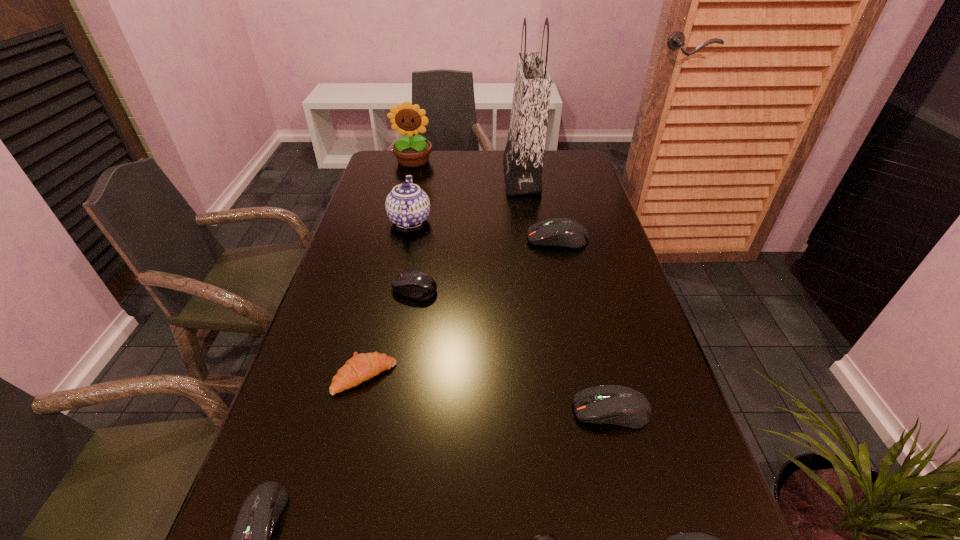
Where is `object at the far left corner`? The height and width of the screenshot is (540, 960). object at the far left corner is located at coordinates (411, 152).

Image resolution: width=960 pixels, height=540 pixels. In the image, there is a desktop. Identify the location of vacant area at the far edge. pos(435,152).

This screenshot has height=540, width=960. Find the location of `vacant space at the left edge`. vacant space at the left edge is located at coordinates (314, 401).

This screenshot has width=960, height=540. In the image, there is a desktop. Find the location of `vacant space at the right edge`. vacant space at the right edge is located at coordinates pyautogui.click(x=628, y=496).

Locate an element on the screen. Image resolution: width=960 pixels, height=540 pixels. unoccupied area between the crescent roll and the eighth shortest object is located at coordinates (387, 299).

Locate an element on the screen. The width and height of the screenshot is (960, 540). empty space between the shopping bag and the second tallest object is located at coordinates (468, 168).

At what (x,y) coordinates should I click in order to perform the action: click on free point between the biggest dark computer equipment and the farther black mouse. Please return your answer as a coordinate pair (x, y). The width and height of the screenshot is (960, 540). Looking at the image, I should click on [486, 264].

Identify which object is the nearest to the sixth nearest object. Please provide its 2D coordinates. Your answer should be formatted as a tuple, i.e. [(x, y)], where the tuple contains the x and y coordinates of a point satisfying the conditions above.

[(407, 206)]

Find the location of `object that is the third closest to the second computer equipment from left to right`. object that is the third closest to the second computer equipment from left to right is located at coordinates (562, 232).

Identify which computer equipment is the fourth closest to the second computer equipment from left to right. Please provide its 2D coordinates. Your answer should be formatted as a tuple, i.e. [(x, y)], where the tuple contains the x and y coordinates of a point satisfying the conditions above.

[(544, 539)]